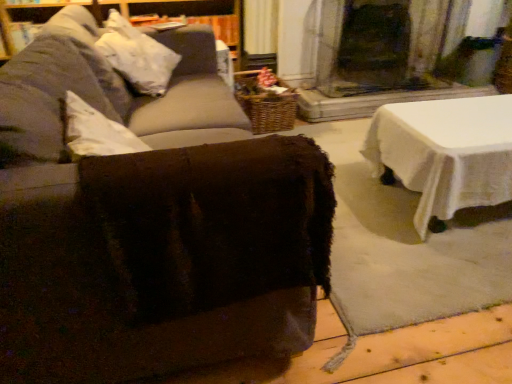
What do you see at coordinates (265, 103) in the screenshot? The image size is (512, 384). I see `woven brown basket at center` at bounding box center [265, 103].

I want to click on woven brown basket at center, so click(265, 103).

From the image's perspective, is white fabric pillow at upper left above or below woven brown basket at center?

white fabric pillow at upper left is above woven brown basket at center.

Which object is more forward, white fabric pillow at upper left or woven brown basket at center?

white fabric pillow at upper left is closer to the camera.

Can you confirm if white fabric pillow at upper left is shorter than woven brown basket at center?

No, white fabric pillow at upper left is not shorter than woven brown basket at center.

Between white fabric pillow at upper left and woven brown basket at center, which one appears on the right side from the viewer's perspective?

woven brown basket at center.

Considering their positions, is white fabric pillow at upper left located in front of or behind brown fuzzy ottoman at center?

white fabric pillow at upper left is behind brown fuzzy ottoman at center.

From a real-world perspective, is white fabric pillow at upper left located higher than brown fuzzy ottoman at center?

Indeed, from a real-world perspective, white fabric pillow at upper left stands above brown fuzzy ottoman at center.

Considering the positions of objects white fabric pillow at upper left and brown fuzzy ottoman at center in the image provided, who is more to the right, white fabric pillow at upper left or brown fuzzy ottoman at center?

Positioned to the right is brown fuzzy ottoman at center.

How different are the orientations of white fabric pillow at upper left and brown fuzzy ottoman at center in degrees?

There is a 1.74-degree angle between the facing directions of white fabric pillow at upper left and brown fuzzy ottoman at center.

Does brown fuzzy ottoman at center turn towards woven brown basket at center?

Yes, brown fuzzy ottoman at center is aimed at woven brown basket at center.

Locate an element on the screen. The width and height of the screenshot is (512, 384). basket beneath the brown fuzzy ottoman at center (from a real-world perspective) is located at coordinates (265, 103).

From a real-world perspective, is brown fuzzy ottoman at center above or below woven brown basket at center?

In terms of real-world spatial position, brown fuzzy ottoman at center is above woven brown basket at center.

What's the angular difference between woven brown basket at center and brown fuzzy ottoman at center's facing directions?

92.7 degrees.

Is woven brown basket at center facing towards brown fuzzy ottoman at center?

No, woven brown basket at center is not turned towards brown fuzzy ottoman at center.

In the scene shown: Is woven brown basket at center far from brown fuzzy ottoman at center?

Yes, woven brown basket at center and brown fuzzy ottoman at center are quite far apart.

From a real-world perspective, does woven brown basket at center stand above brown fuzzy ottoman at center?

No, from a real-world perspective, woven brown basket at center is not above brown fuzzy ottoman at center.

Between brown fuzzy ottoman at center and white fabric pillow at upper left, which one appears on the left side from the viewer's perspective?

Positioned to the left is white fabric pillow at upper left.

Can you confirm if brown fuzzy ottoman at center is bigger than white fabric pillow at upper left?

Yes.

From a real-world perspective, does brown fuzzy ottoman at center sit lower than white fabric pillow at upper left?

Yes.

Considering the sizes of objects brown fuzzy ottoman at center and white fabric pillow at upper left in the image provided, who is wider, brown fuzzy ottoman at center or white fabric pillow at upper left?

brown fuzzy ottoman at center.

Is woven brown basket at center shorter than white fabric pillow at upper left?

Correct, woven brown basket at center is not as tall as white fabric pillow at upper left.

From a real-world perspective, is woven brown basket at center above or below white fabric pillow at upper left?

woven brown basket at center is situated lower than white fabric pillow at upper left in the real world.

In terms of size, does woven brown basket at center appear bigger or smaller than white fabric pillow at upper left?

In the image, woven brown basket at center appears to be larger than white fabric pillow at upper left.

From the image's perspective, does woven brown basket at center appear higher than white fabric pillow at upper left?

Incorrect, from the image's perspective, woven brown basket at center is lower than white fabric pillow at upper left.

This screenshot has width=512, height=384. I want to click on basket that is on the right side of white fabric pillow at upper left, so click(x=265, y=103).

Locate an element on the screen. pillow lying on the left of brown fuzzy ottoman at center is located at coordinates (137, 56).

From the image, which object appears to be nearer to woven brown basket at center, brown fuzzy ottoman at center or white fabric pillow at upper left?

white fabric pillow at upper left is positioned closer to the anchor woven brown basket at center.

From the image, which object appears to be nearer to white fabric pillow at upper left, woven brown basket at center or brown fuzzy ottoman at center?

brown fuzzy ottoman at center lies closer to white fabric pillow at upper left than the other object.

When comparing their distances from brown fuzzy ottoman at center, does white fabric pillow at upper left or woven brown basket at center seem further?

woven brown basket at center is further to brown fuzzy ottoman at center.

When comparing their distances from white fabric pillow at upper left, does brown fuzzy ottoman at center or woven brown basket at center seem further?

Among the two, woven brown basket at center is located further to white fabric pillow at upper left.

Looking at the image, which one is located closer to brown fuzzy ottoman at center, woven brown basket at center or white fabric pillow at upper left?

white fabric pillow at upper left lies closer to brown fuzzy ottoman at center than the other object.

From the image, which object appears to be farther from woven brown basket at center, white fabric pillow at upper left or brown fuzzy ottoman at center?

The object further to woven brown basket at center is brown fuzzy ottoman at center.

The width and height of the screenshot is (512, 384). I want to click on pillow between brown fuzzy ottoman at center and woven brown basket at center from front to back, so click(x=137, y=56).